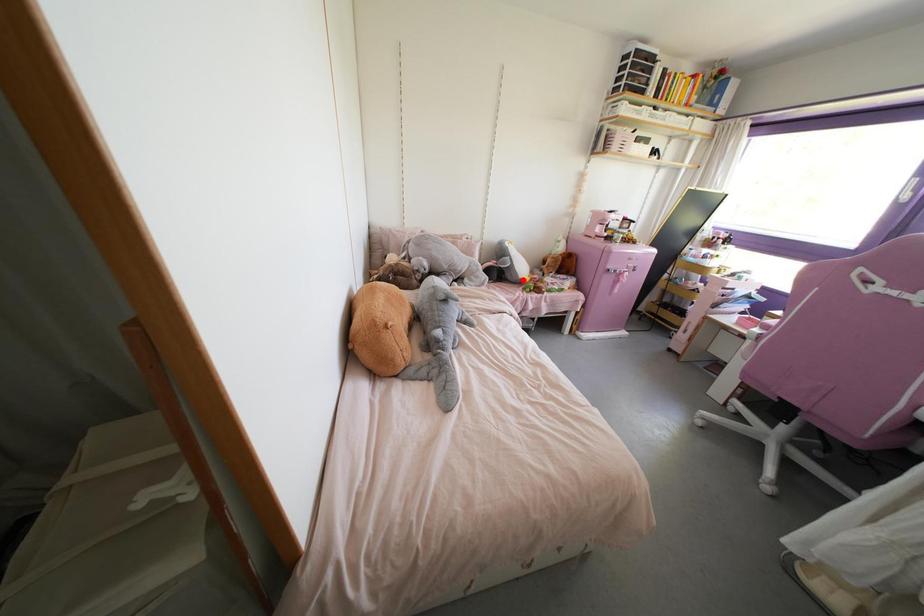
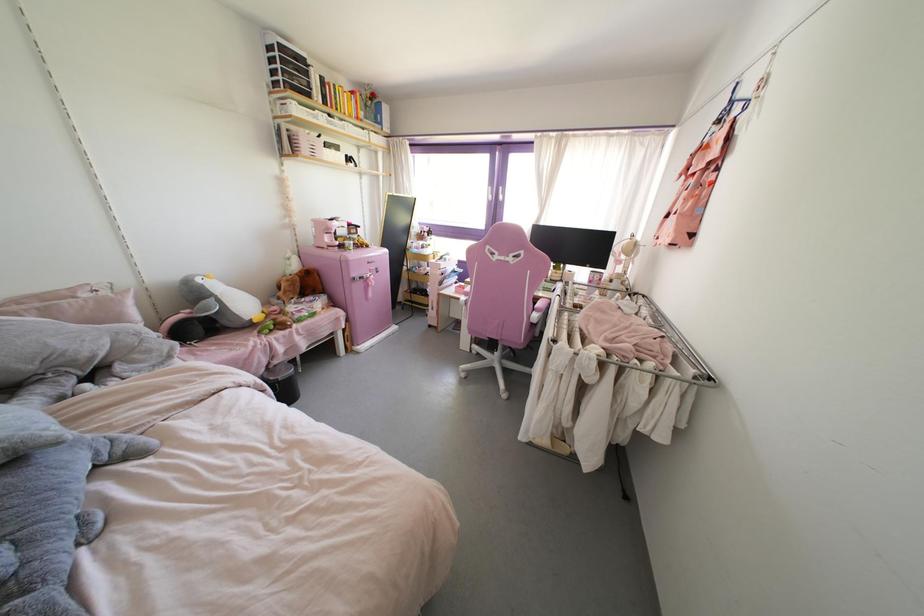
Locate, in the second image, the point that corresponds to the highlighted location in the first image.

(254, 320)